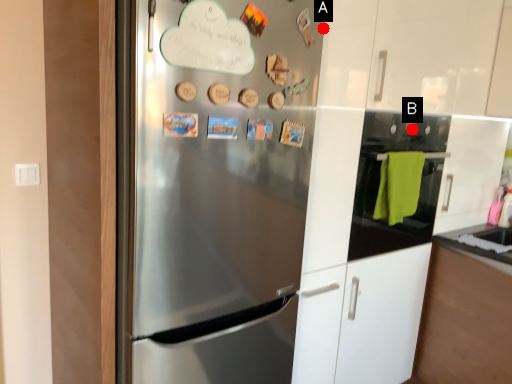
Question: Two points are circled on the image, labeled by A and B beside each circle. Which point is farther from the camera taking this photo?

Choices:
 (A) A is further
 (B) B is further

Answer: (B)